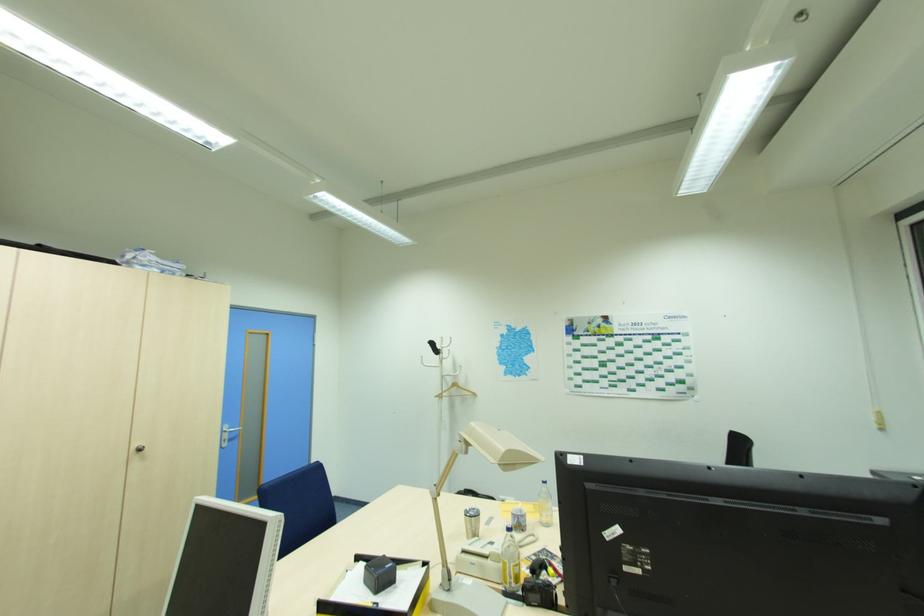
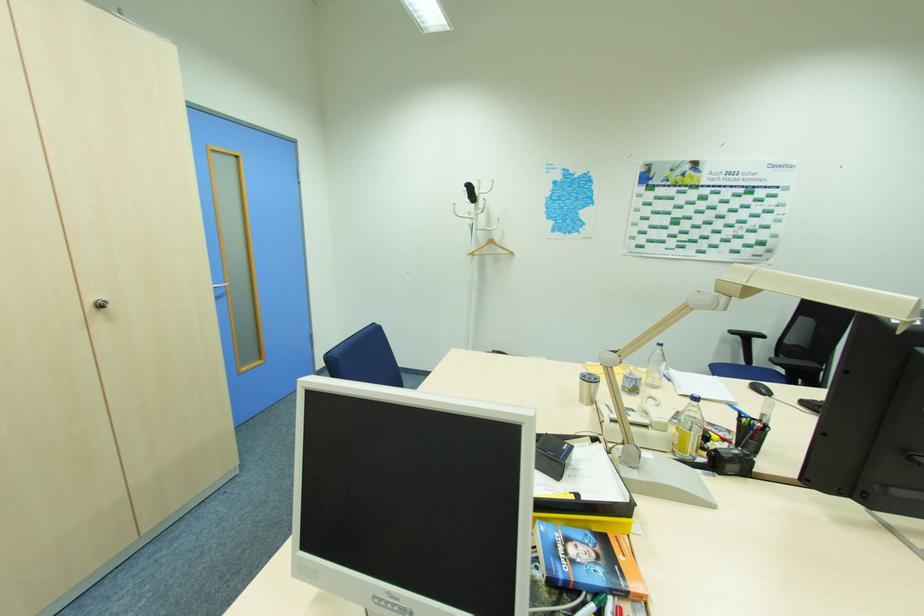
Where in the second image is the point corresponding to point (427, 365) from the first image?

(459, 216)